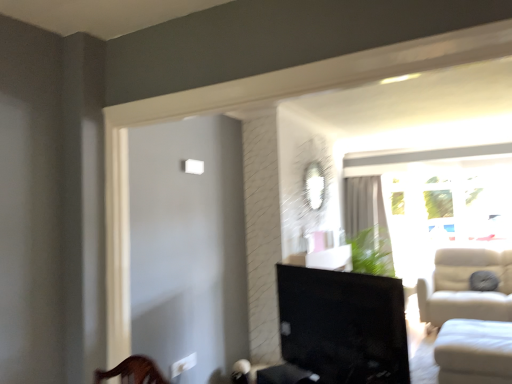
Question: Is white sheer curtain at upper right inside or outside of white fabric studio couch at lower right?

Choices:
 (A) outside
 (B) inside

Answer: (A)

Question: From a real-world perspective, relative to white fabric studio couch at lower right, is white sheer curtain at upper right vertically above or below?

Choices:
 (A) above
 (B) below

Answer: (A)

Question: Based on their relative distances, which object is nearer to the white fabric studio couch at lower right?

Choices:
 (A) matte black tv at center
 (B) transparent glass window at right
 (C) white sheer curtain at upper right

Answer: (A)

Question: Which of these objects is positioned farthest from the matte black tv at center?

Choices:
 (A) transparent glass window at right
 (B) white fabric studio couch at lower right
 (C) white sheer curtain at upper right

Answer: (A)